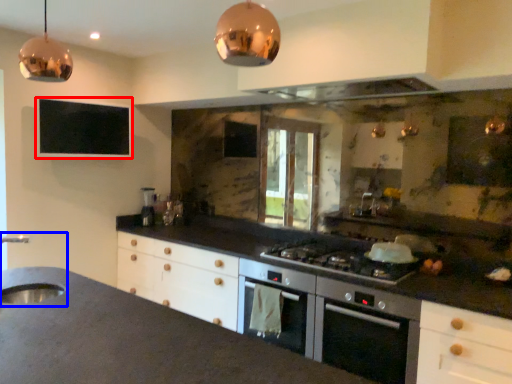
Question: Which object is closer to the camera taking this photo, window screen (highlighted by a red box) or sink (highlighted by a blue box)?

Choices:
 (A) window screen
 (B) sink

Answer: (B)